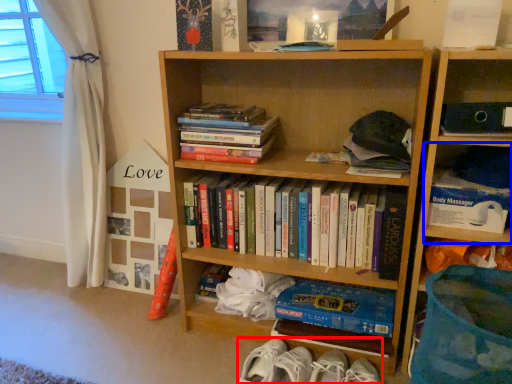
Question: Among these objects, which one is farthest to the camera, footwear (highlighted by a red box) or shelf (highlighted by a blue box)?

Choices:
 (A) footwear
 (B) shelf

Answer: (A)